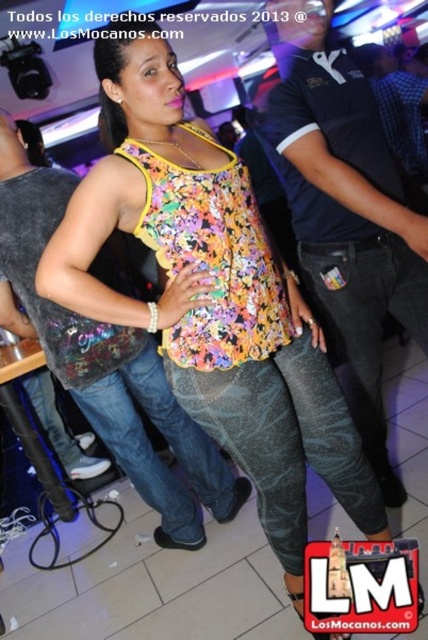
Between black cotton polo shirt at center and denim jeans at center, which one is positioned lower?

denim jeans at center

Can you confirm if black cotton polo shirt at center is taller than denim jeans at center?

Indeed, black cotton polo shirt at center has a greater height compared to denim jeans at center.

Find the location of `black cotton polo shirt at center`. black cotton polo shirt at center is located at coordinates (345, 209).